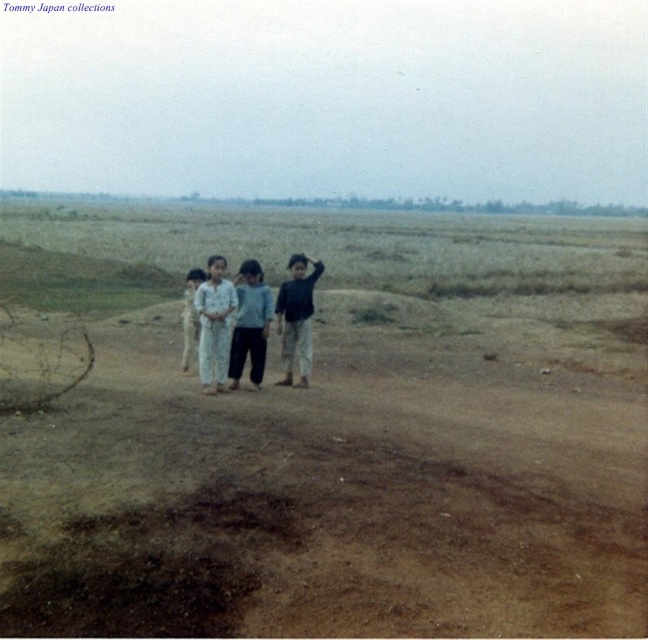
Describe the element at coordinates (295, 317) in the screenshot. Image resolution: width=648 pixels, height=640 pixels. I see `dark blue shirt at center` at that location.

Who is higher up, dark blue shirt at center or light blue denim jacket at center?

dark blue shirt at center is above.

The width and height of the screenshot is (648, 640). What are the coordinates of `dark blue shirt at center` in the screenshot? It's located at (295, 317).

Does white cotton pants at center appear on the right side of dark blue shirt at center?

Incorrect, white cotton pants at center is not on the right side of dark blue shirt at center.

How far apart are white cotton pants at center and dark blue shirt at center?

white cotton pants at center is 36.92 inches away from dark blue shirt at center.

Where is `white cotton pants at center`? This screenshot has height=640, width=648. white cotton pants at center is located at coordinates (214, 324).

Identify the location of white cotton pants at center. The image size is (648, 640). (214, 324).

Can you confirm if white cotton pants at center is taller than light blue denim jacket at center?

Indeed, white cotton pants at center has a greater height compared to light blue denim jacket at center.

Between white cotton pants at center and light blue denim jacket at center, which one is positioned higher?

white cotton pants at center is higher up.

Where is `white cotton pants at center`? white cotton pants at center is located at coordinates (214, 324).